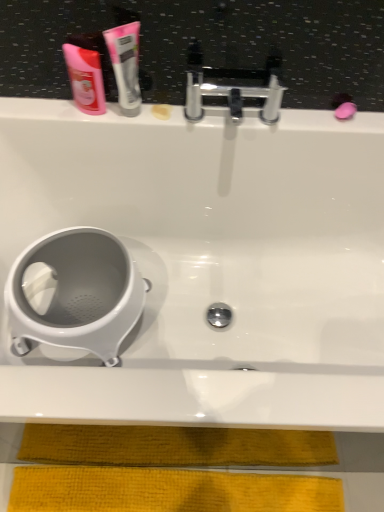
Locate an element on the screen. The image size is (384, 512). vacant area to the right of pink glossy mouthwash at upper left is located at coordinates (155, 121).